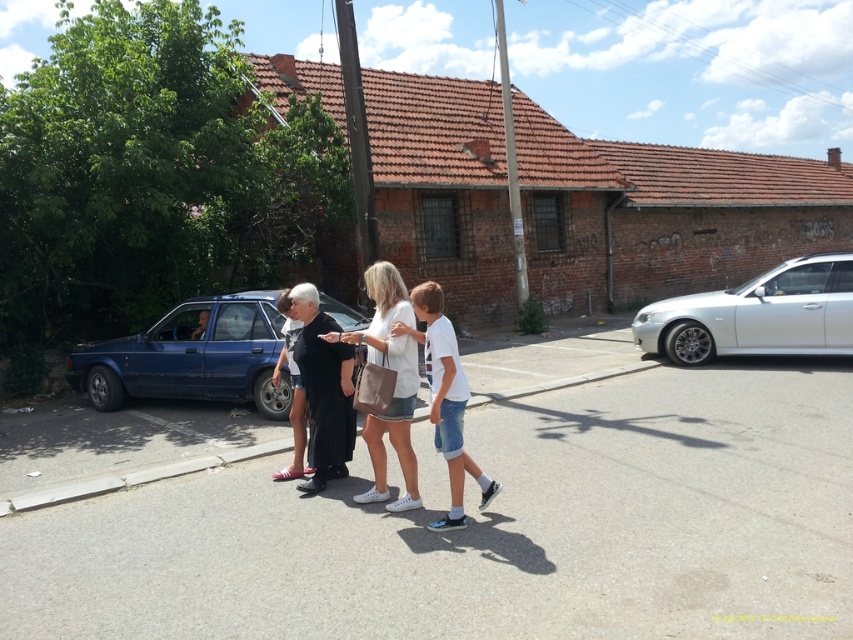
Question: Is white cotton shirt at center bigger than matte black car at left?

Choices:
 (A) no
 (B) yes

Answer: (B)

Question: Which of the following is the farthest from the observer?

Choices:
 (A) (685, 304)
 (B) (480, 488)

Answer: (A)

Question: Does white metallic car at right come behind white cotton shirt at center?

Choices:
 (A) yes
 (B) no

Answer: (A)

Question: Which object is closer to the camera taking this photo?

Choices:
 (A) white cotton shirt at center
 (B) matte black car at left
 (C) blue matte sedan at left
 (D) white metallic car at right

Answer: (A)

Question: Among these objects, which one is farthest from the camera?

Choices:
 (A) white matte shirt at center
 (B) white metallic car at right

Answer: (B)

Question: Is blue matte sedan at left wider than matte black car at left?

Choices:
 (A) yes
 (B) no

Answer: (A)